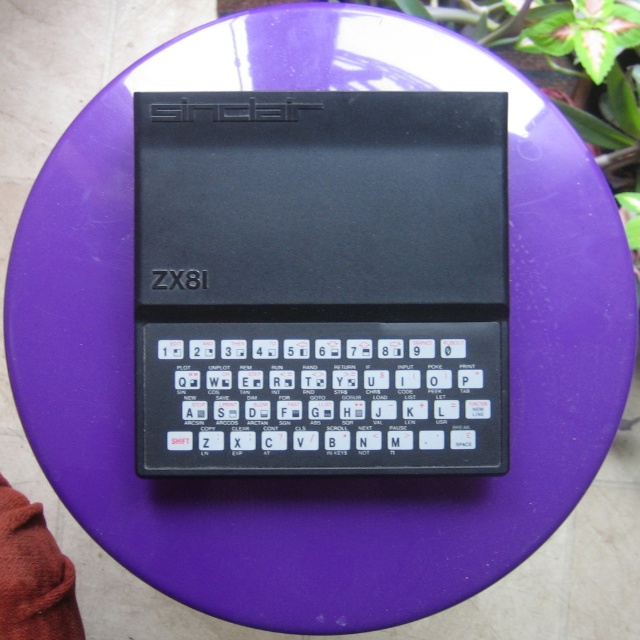
Consider the image. Is black plastic sinclair zx81 at center to the left of black plastic keyboard at center from the viewer's perspective?

Incorrect, black plastic sinclair zx81 at center is not on the left side of black plastic keyboard at center.

Is black plastic sinclair zx81 at center further to the viewer compared to black plastic keyboard at center?

That is False.

Does point (278, 220) come in front of point (451, 417)?

Yes, it is in front of point (451, 417).

Locate an element on the screen. This screenshot has height=640, width=640. black plastic sinclair zx81 at center is located at coordinates (321, 282).